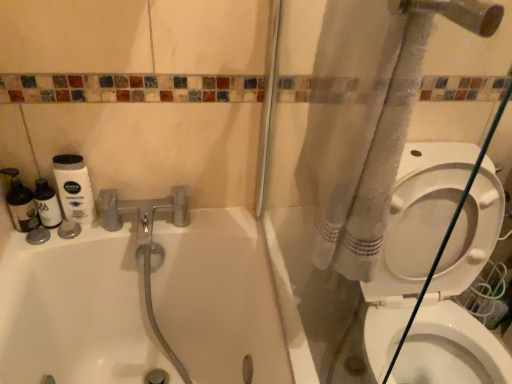
Question: Is point (384, 339) closer or farther from the camera than point (330, 51)?

Choices:
 (A) farther
 (B) closer

Answer: (A)

Question: Is white glossy bidet at lower right bigger or smaller than white fabric shower curtain at right?

Choices:
 (A) small
 (B) big

Answer: (A)

Question: Estimate the real-world distances between objects in this image. Which object is closer to the white glossy bathtub at upper left?

Choices:
 (A) white glossy bidet at lower right
 (B) white fabric shower curtain at right

Answer: (B)

Question: Based on their relative distances, which object is nearer to the white fabric shower curtain at right?

Choices:
 (A) white glossy bathtub at upper left
 (B) white glossy bidet at lower right

Answer: (A)